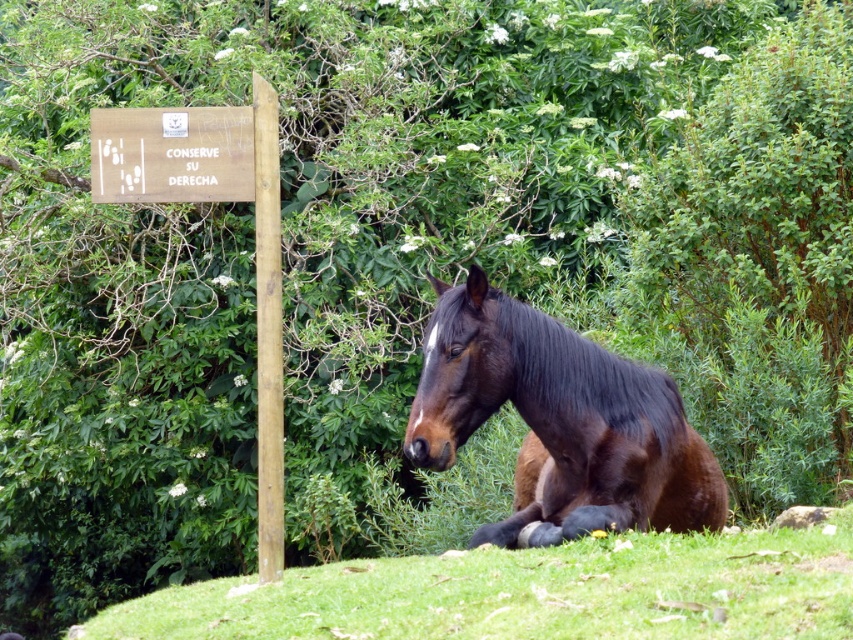
Who is taller, shiny brown horse at center or wooden sign at upper left?

→ Standing taller between the two is shiny brown horse at center.

Does shiny brown horse at center have a lesser height compared to wooden sign at upper left?

In fact, shiny brown horse at center may be taller than wooden sign at upper left.

The width and height of the screenshot is (853, 640). Identify the location of shiny brown horse at center. (560, 420).

Is point (442, 572) positioned behind point (447, 458)?

No.

Which is above, green grass at lower right or shiny brown horse at center?

shiny brown horse at center is higher up.

This screenshot has width=853, height=640. In order to click on green grass at lower right in this screenshot , I will do `click(532, 593)`.

This screenshot has height=640, width=853. What are the coordinates of `green grass at lower right` in the screenshot? It's located at (532, 593).

Who is lower down, wooden sign at upper left or light brown wooden post at left?

Answer: light brown wooden post at left is below.

Is wooden sign at upper left positioned behind light brown wooden post at left?

Yes.

Locate an element on the screen. wooden sign at upper left is located at coordinates (172, 154).

Image resolution: width=853 pixels, height=640 pixels. I want to click on wooden sign at upper left, so click(172, 154).